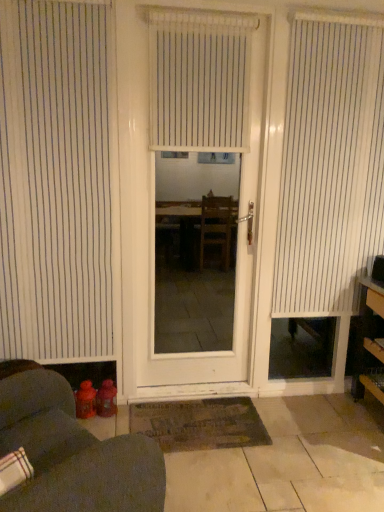
I want to click on empty space that is ontop of white matte door at center, so click(x=198, y=13).